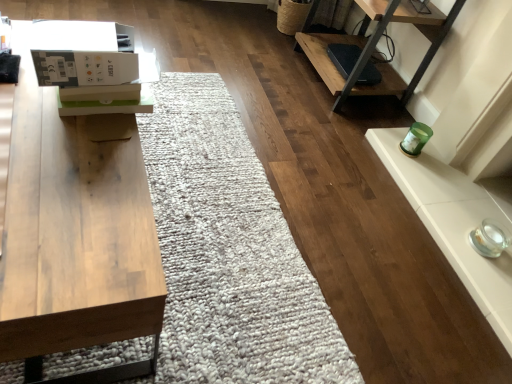
Question: Is white cardboard box at upper left wider or thinner than wooden table at left?

Choices:
 (A) thin
 (B) wide

Answer: (A)

Question: From a real-world perspective, relative to wooden table at left, is white cardboard box at upper left vertically above or below?

Choices:
 (A) below
 (B) above

Answer: (B)

Question: In terms of size, does white cardboard box at upper left appear bigger or smaller than wooden table at left?

Choices:
 (A) big
 (B) small

Answer: (B)

Question: Considering their positions, is wooden table at left located in front of or behind white cardboard box at upper left?

Choices:
 (A) front
 (B) behind

Answer: (A)

Question: Is point (126, 365) positioned closer to the camera than point (31, 29)?

Choices:
 (A) farther
 (B) closer

Answer: (A)

Question: Which is correct: wooden table at left is inside white cardboard box at upper left, or outside of it?

Choices:
 (A) outside
 (B) inside

Answer: (A)

Question: From a real-world perspective, relative to white cardboard box at upper left, is wooden table at left vertically above or below?

Choices:
 (A) below
 (B) above

Answer: (A)